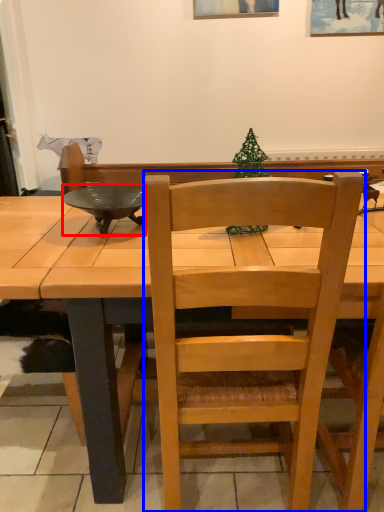
Question: Among these objects, which one is nearest to the camera, bowl (highlighted by a red box) or chair (highlighted by a blue box)?

Choices:
 (A) bowl
 (B) chair

Answer: (B)